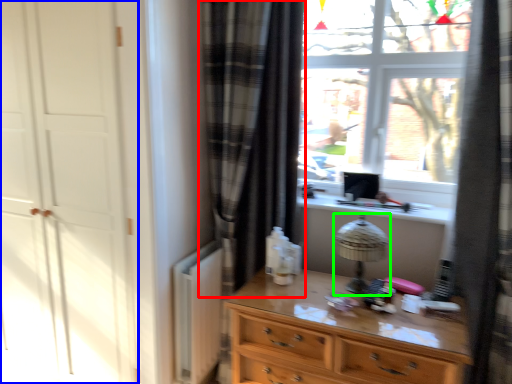
Question: Based on their relative distances, which object is nearer to curtain (highlighted by a red box)? Choose from screen door (highlighted by a blue box) and table lamp (highlighted by a green box).

Choices:
 (A) screen door
 (B) table lamp

Answer: (B)